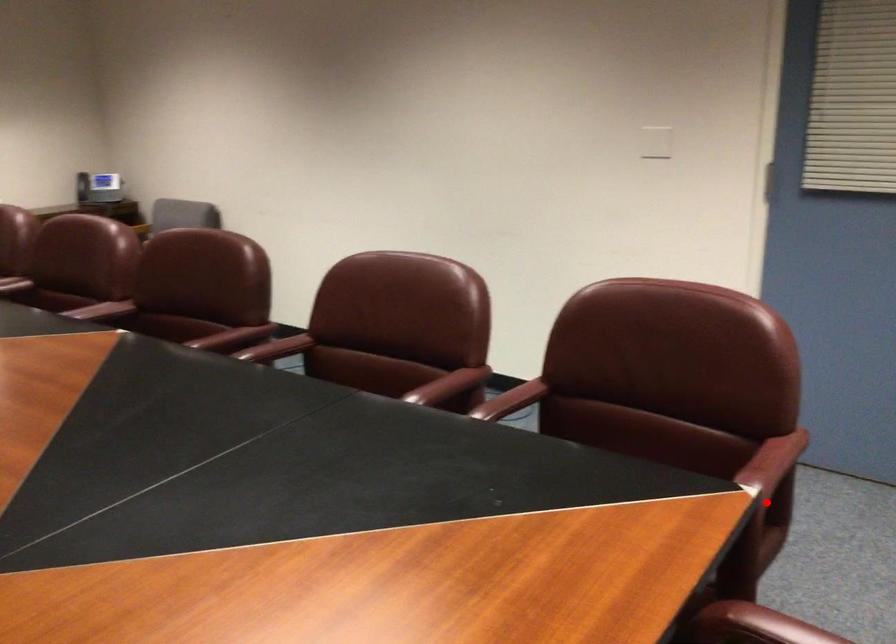
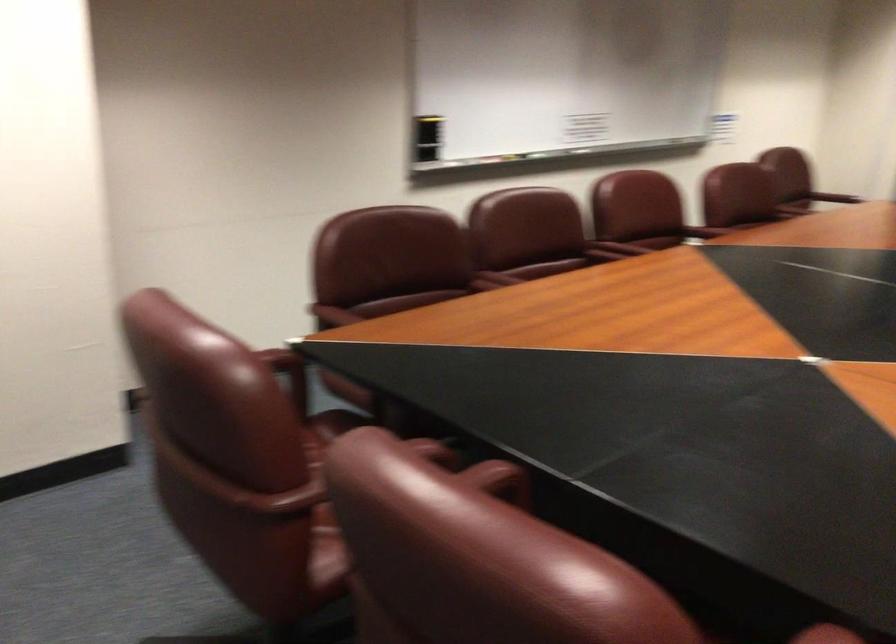
Question: I am providing you with two images of the same scene from different viewpoints. Image1 has a red point marked. In image2, the corresponding 3D location appears at what relative position? Reply with the corresponding letter.

Choices:
 (A) Closer
 (B) Farther

Answer: (B)